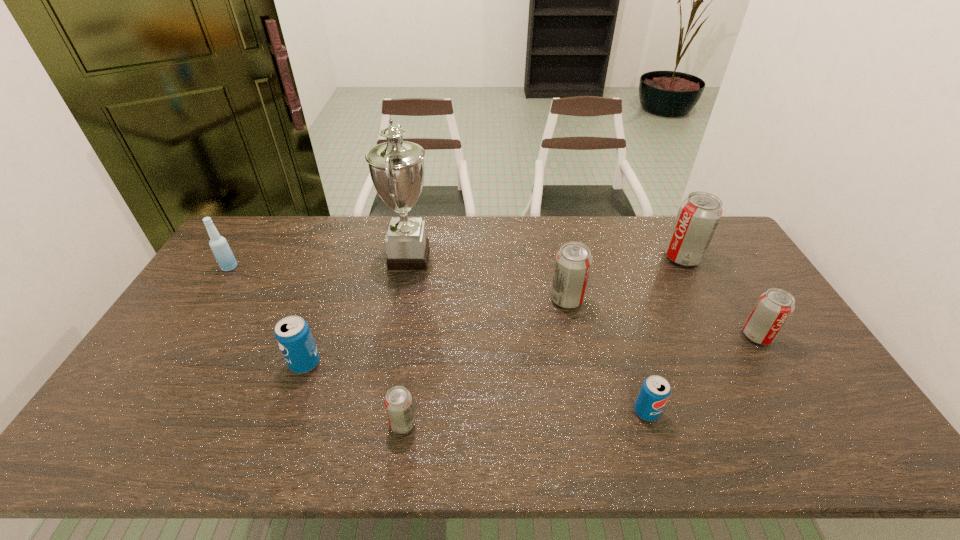
In order to click on vacant region at the far left corner in this screenshot , I will do `click(247, 252)`.

Identify the location of free location at the far right corner. Image resolution: width=960 pixels, height=540 pixels. (718, 253).

This screenshot has height=540, width=960. Identify the location of free spot between the leftmost object and the third biggest gray soda can. (493, 301).

The image size is (960, 540). Identify the location of free space between the trophy cup and the smaller blue soda can. (528, 335).

Where is `vacant area between the fourth nearest object and the nearest gray soda can`? The image size is (960, 540). vacant area between the fourth nearest object and the nearest gray soda can is located at coordinates (580, 380).

Where is `free space that is in between the tallest soda can and the fifth nearest soda can`? The image size is (960, 540). free space that is in between the tallest soda can and the fifth nearest soda can is located at coordinates click(x=625, y=278).

Identify the location of free space between the farthest soda can and the tallest object. [546, 258].

I want to click on free spot between the left blue soda can and the trophy cup, so click(357, 310).

Where is `blank region between the tallest object and the leftmost object`? This screenshot has height=540, width=960. blank region between the tallest object and the leftmost object is located at coordinates (x=320, y=262).

Image resolution: width=960 pixels, height=540 pixels. In order to click on vacant space that is in between the right blue soda can and the nearest gray soda can in this screenshot , I will do `click(524, 417)`.